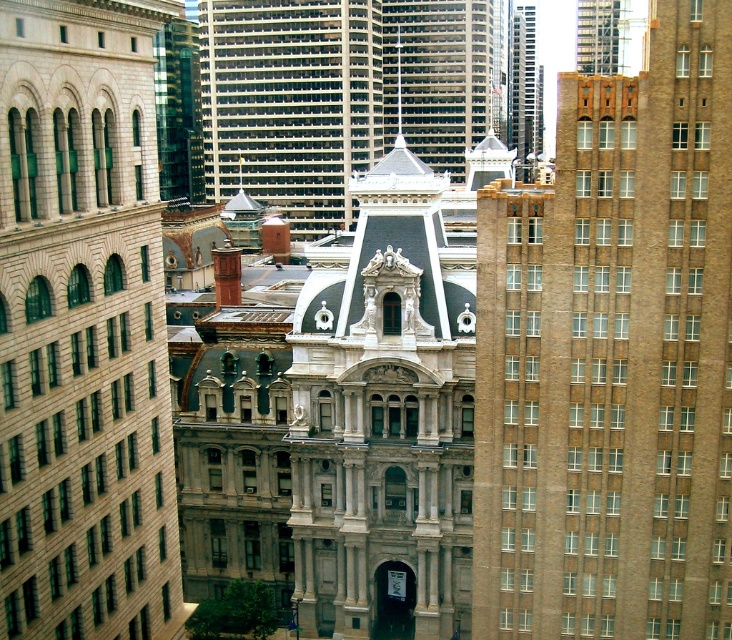
Question: Is beige stone building at left to the left of gray concrete skyscraper at center from the viewer's perspective?

Choices:
 (A) yes
 (B) no

Answer: (A)

Question: Considering the real-world distances, which object is closest to the gray concrete skyscraper at center?

Choices:
 (A) smooth gray spire at center
 (B) glassy steel skyscraper at upper center
 (C) brown brick building at center

Answer: (A)

Question: Considering the relative positions of beige stone building at left and smooth gray spire at center in the image provided, where is beige stone building at left located with respect to smooth gray spire at center?

Choices:
 (A) above
 (B) below

Answer: (B)

Question: Which of the following is the farthest from the observer?

Choices:
 (A) beige stone building at left
 (B) smooth gray spire at center
 (C) glassy steel skyscraper at upper center

Answer: (C)

Question: Which of the following is the closest to the observer?

Choices:
 (A) beige stone building at left
 (B) glassy steel skyscraper at upper center
 (C) brown brick building at center

Answer: (A)

Question: Is gray concrete skyscraper at center to the left of glassy steel skyscraper at upper center from the viewer's perspective?

Choices:
 (A) yes
 (B) no

Answer: (A)